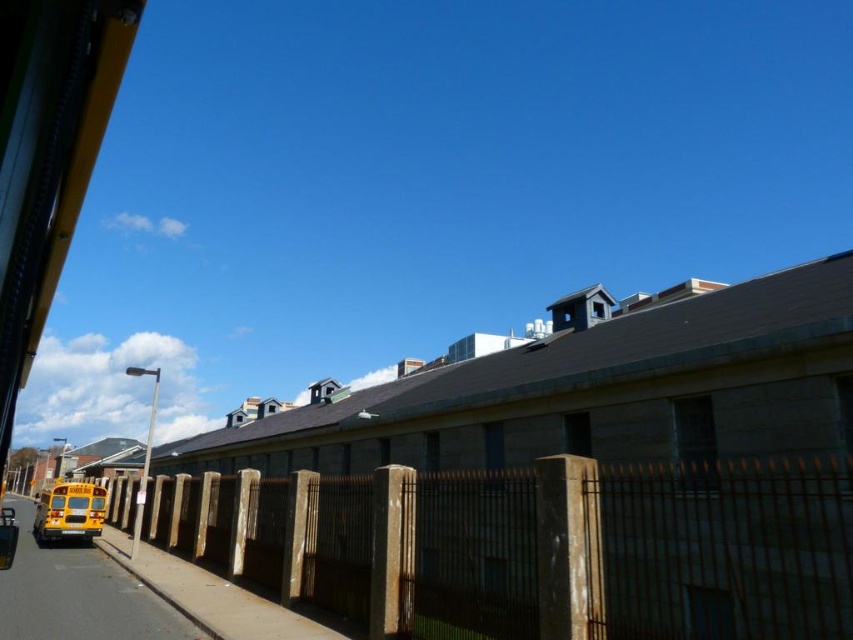
Based on the photo, you are a delivery person trying to park your van near the school bus. The van requires a space that is wider than the rusty metal fence at lower left. Can you park on the smooth asphalt road at lower left?

The rusty metal fence at lower left is narrower than the smooth asphalt road at lower left. Since the van needs a space wider than the fence, the smooth asphalt road at lower left is wide enough for parking.

You are standing at the point marked as point (534,547) in the image. What object is directly in front of you?

The rusty metal fence at lower left is directly in front of you at point (534,547).